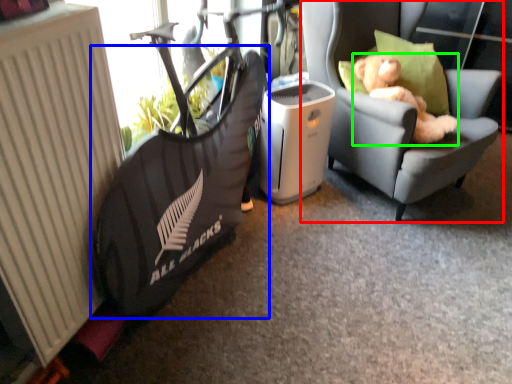
Question: Which is nearer to the chair (highlighted by a red box)? bean bag chair (highlighted by a blue box) or animal (highlighted by a green box).

Choices:
 (A) bean bag chair
 (B) animal

Answer: (B)